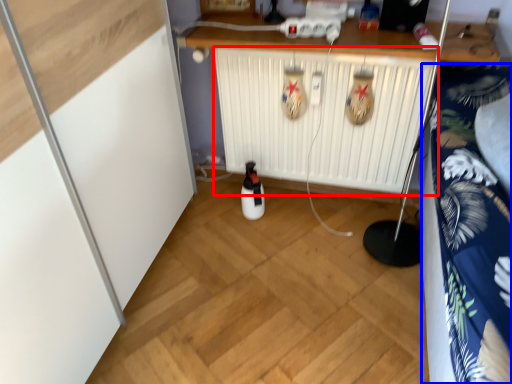
Question: Which of the following is the closest to the observer, radiator (highlighted by a red box) or bedding (highlighted by a blue box)?

Choices:
 (A) radiator
 (B) bedding

Answer: (B)